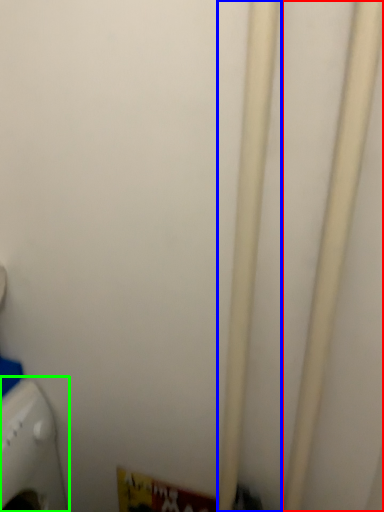
Question: Which object is positioned farthest from pipe (highlighted by a red box)? Select from pipe (highlighted by a blue box) and home appliance (highlighted by a green box).

Choices:
 (A) pipe
 (B) home appliance

Answer: (B)